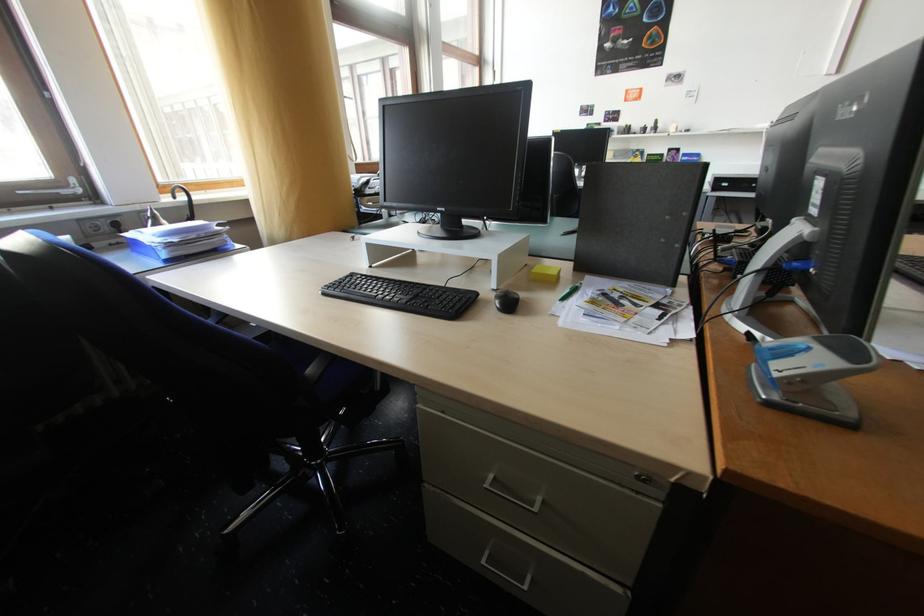
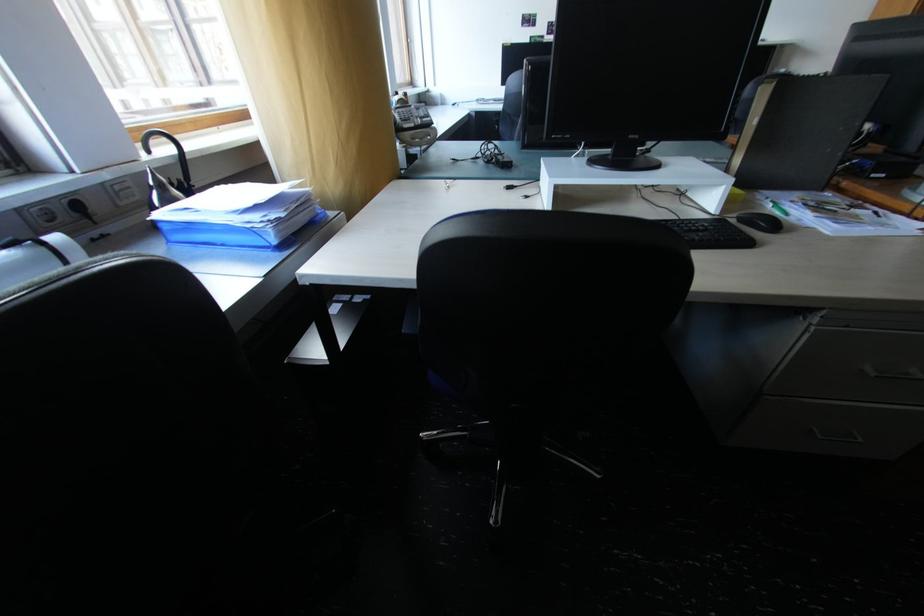
Where in the second image is the point corresponding to (492,564) from the first image?

(830, 439)